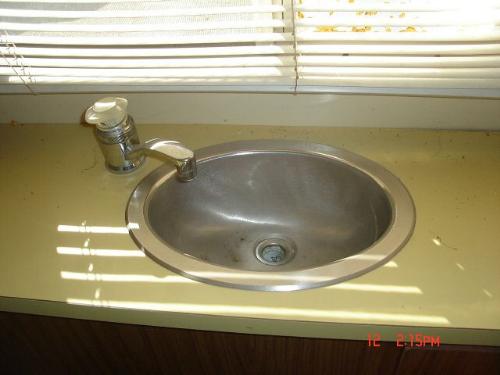
Where is `venetian blind`? The height and width of the screenshot is (375, 500). venetian blind is located at coordinates (105, 42).